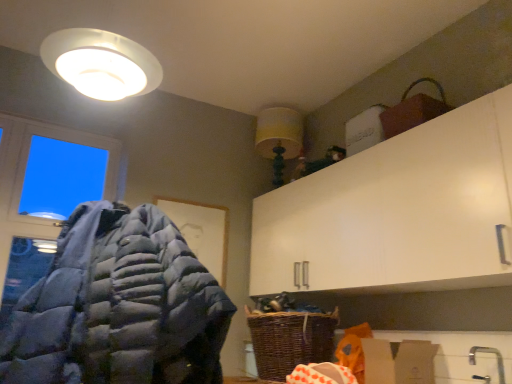
Describe the element at coordinates (279, 138) in the screenshot. The image size is (512, 384). I see `yellow fabric lampshade at upper center` at that location.

This screenshot has height=384, width=512. Describe the element at coordinates (399, 361) in the screenshot. I see `brown cardboard box at lower right` at that location.

Describe the element at coordinates (290, 340) in the screenshot. I see `woven brown basket at lower center` at that location.

Measure the distance between gray down jacket at left and camera.

The distance of gray down jacket at left from camera is 1.34 meters.

Identify the location of yellow fabric lampshade at upper center. Image resolution: width=512 pixels, height=384 pixels. (279, 138).

Considering the relative sizes of brown cardboard box at lower right and woven brown basket at lower center in the image provided, is brown cardboard box at lower right taller than woven brown basket at lower center?

No, brown cardboard box at lower right is not taller than woven brown basket at lower center.

Is the depth of brown cardboard box at lower right less than that of woven brown basket at lower center?

Yes.

Is brown cardboard box at lower right oriented towards woven brown basket at lower center?

No.

From a real-world perspective, which is physically below, brown cardboard box at lower right or woven brown basket at lower center?

brown cardboard box at lower right, from a real-world perspective.

Does transparent glass window at upper left have a lesser width compared to brown cardboard box at lower right?

Yes.

I want to click on window that appears on the left of brown cardboard box at lower right, so click(x=52, y=170).

Is transparent glass window at upper left turned away from brown cardboard box at lower right?

No.

Does brown cardboard box at lower right turn towards gray down jacket at left?

Yes, brown cardboard box at lower right is facing gray down jacket at left.

Does brown cardboard box at lower right have a greater width compared to gray down jacket at left?

In fact, brown cardboard box at lower right might be narrower than gray down jacket at left.

Based on their positions, is brown cardboard box at lower right located to the left or right of gray down jacket at left?

Based on their positions, brown cardboard box at lower right is located to the right of gray down jacket at left.

Looking at this image, is brown cardboard box at lower right situated inside gray down jacket at left or outside?

brown cardboard box at lower right is outside gray down jacket at left.

Considering the sizes of objects woven brown basket at lower center and yellow fabric lampshade at upper center in the image provided, who is shorter, woven brown basket at lower center or yellow fabric lampshade at upper center?

woven brown basket at lower center.

Which object is positioned more to the right, woven brown basket at lower center or yellow fabric lampshade at upper center?

woven brown basket at lower center.

Is woven brown basket at lower center with yellow fabric lampshade at upper center?

woven brown basket at lower center is not next to yellow fabric lampshade at upper center, and they're not touching.

Is point (261, 323) in front of point (294, 130)?

That is True.

Is transparent glass window at upper left taller or shorter than yellow fabric lampshade at upper center?

Clearly, transparent glass window at upper left is taller compared to yellow fabric lampshade at upper center.

From the image's perspective, is transparent glass window at upper left located above or below yellow fabric lampshade at upper center?

Based on their image positions, transparent glass window at upper left is located beneath yellow fabric lampshade at upper center.

At what (x,y) coordinates should I click in order to perform the action: click on light fixture that is on the right side of transparent glass window at upper left. Please return your answer as a coordinate pair (x, y). Image resolution: width=512 pixels, height=384 pixels. Looking at the image, I should click on (279, 138).

Would you say transparent glass window at upper left is inside or outside yellow fabric lampshade at upper center?

transparent glass window at upper left lies outside yellow fabric lampshade at upper center.

Based on the photo, considering the sizes of objects transparent glass window at upper left and gray down jacket at left in the image provided, who is thinner, transparent glass window at upper left or gray down jacket at left?

transparent glass window at upper left.

Can gray down jacket at left be found inside transparent glass window at upper left?

Definitely not — gray down jacket at left is not inside transparent glass window at upper left.

Based on the photo, from the image's perspective, is transparent glass window at upper left under gray down jacket at left?

Actually, transparent glass window at upper left appears above gray down jacket at left in the image.

Looking at their sizes, would you say yellow fabric lampshade at upper center is wider or thinner than woven brown basket at lower center?

Clearly, yellow fabric lampshade at upper center has less width compared to woven brown basket at lower center.

From the picture: Which of these two, yellow fabric lampshade at upper center or woven brown basket at lower center, stands shorter?

Standing shorter between the two is woven brown basket at lower center.

Between yellow fabric lampshade at upper center and woven brown basket at lower center, which one has smaller size?

yellow fabric lampshade at upper center.

Image resolution: width=512 pixels, height=384 pixels. I want to click on basket on the left of brown cardboard box at lower right, so pyautogui.click(x=290, y=340).

The width and height of the screenshot is (512, 384). I want to click on window above the brown cardboard box at lower right (from the image's perspective), so click(x=52, y=170).

When comparing their distances from transparent glass window at upper left, does woven brown basket at lower center or brown cardboard box at lower right seem closer?

Among the two, woven brown basket at lower center is located nearer to transparent glass window at upper left.

Estimate the real-world distances between objects in this image. Which object is closer to transparent glass window at upper left, yellow fabric lampshade at upper center or gray down jacket at left?

The object closer to transparent glass window at upper left is yellow fabric lampshade at upper center.

Consider the image. From the image, which object appears to be nearer to yellow fabric lampshade at upper center, transparent glass window at upper left or brown cardboard box at lower right?

transparent glass window at upper left.

Estimate the real-world distances between objects in this image. Which object is closer to woven brown basket at lower center, yellow fabric lampshade at upper center or brown cardboard box at lower right?

brown cardboard box at lower right.

Consider the image. From the image, which object appears to be farther from brown cardboard box at lower right, woven brown basket at lower center or yellow fabric lampshade at upper center?

Among the two, yellow fabric lampshade at upper center is located further to brown cardboard box at lower right.

Based on their spatial positions, is brown cardboard box at lower right or woven brown basket at lower center closer to gray down jacket at left?

The object closer to gray down jacket at left is woven brown basket at lower center.

Which object lies nearer to the anchor point brown cardboard box at lower right, gray down jacket at left or transparent glass window at upper left?

Based on the image, gray down jacket at left appears to be nearer to brown cardboard box at lower right.

Looking at the image, which one is located closer to yellow fabric lampshade at upper center, woven brown basket at lower center or gray down jacket at left?

woven brown basket at lower center lies closer to yellow fabric lampshade at upper center than the other object.

Locate an element on the screen. The height and width of the screenshot is (384, 512). light fixture located between transparent glass window at upper left and woven brown basket at lower center in the left-right direction is located at coordinates (279, 138).

Locate an element on the screen. basket between transparent glass window at upper left and brown cardboard box at lower right from left to right is located at coordinates (290, 340).

Image resolution: width=512 pixels, height=384 pixels. Identify the location of jacket between transparent glass window at upper left and brown cardboard box at lower right in the horizontal direction. (118, 307).

Locate an element on the screen. The height and width of the screenshot is (384, 512). cardboard box located between gray down jacket at left and yellow fabric lampshade at upper center in the depth direction is located at coordinates (399, 361).